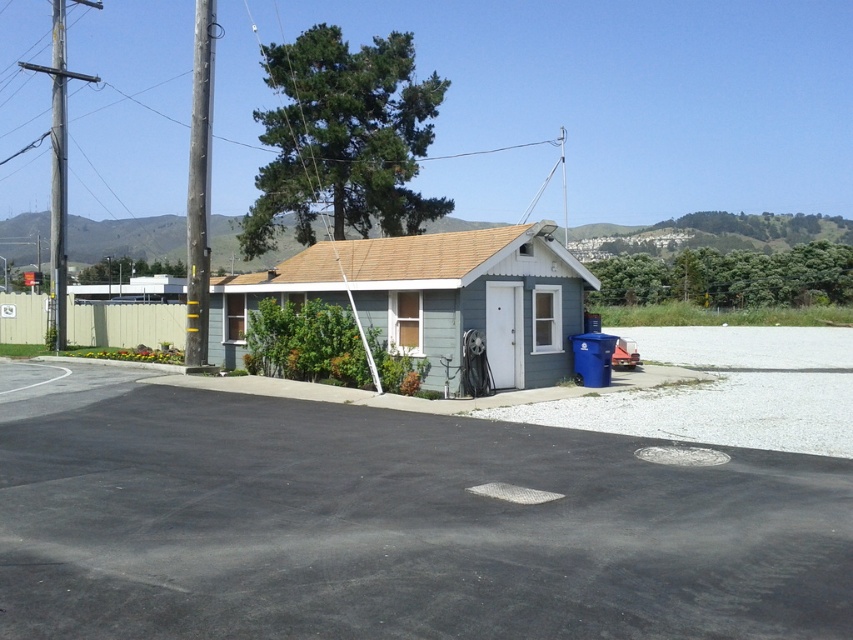
Question: Does black asphalt parking lot at lower left have a larger size compared to light blue siding at center?

Choices:
 (A) no
 (B) yes

Answer: (A)

Question: Which object appears closest to the camera in this image?

Choices:
 (A) black asphalt parking lot at lower left
 (B) light blue siding at center
 (C) brushed metal utility pole at left

Answer: (A)

Question: Does black asphalt parking lot at lower left have a greater width compared to brown wooden utility pole at upper left?

Choices:
 (A) yes
 (B) no

Answer: (B)

Question: Which object is positioned farthest from the brushed metal utility pole at left?

Choices:
 (A) brown wooden utility pole at upper left
 (B) black asphalt parking lot at lower left
 (C) light blue siding at center

Answer: (B)

Question: Which point is farther to the camera?

Choices:
 (A) brown wooden utility pole at upper left
 (B) black asphalt parking lot at lower left

Answer: (A)

Question: Can you confirm if black asphalt parking lot at lower left is smaller than brushed metal utility pole at left?

Choices:
 (A) no
 (B) yes

Answer: (B)